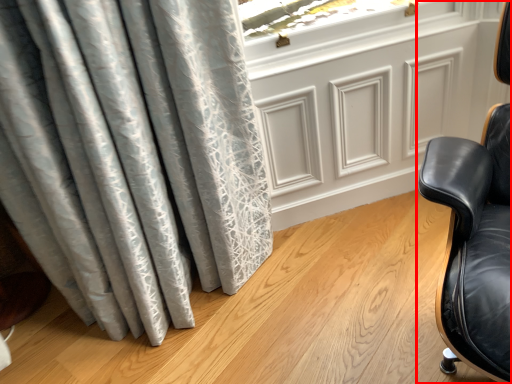
Question: From the image's perspective, where is chair (annotated by the red box) located relative to screen door?

Choices:
 (A) above
 (B) below

Answer: (B)